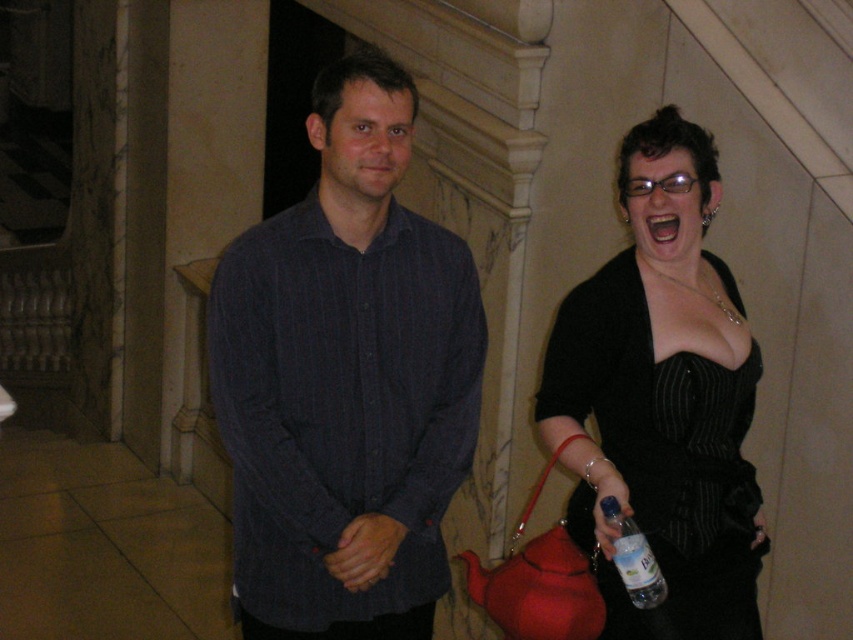
You are a photographer setting up for a formal event. You have to decide which object to focus on first between the black satin dress at right and the clear plastic bottle at lower right. Considering their sizes, which one should you prioritize?

The black satin dress at right has a larger size compared to the clear plastic bottle at lower right, so you should prioritize focusing on the black satin dress at right first.

You are standing at the point marked by the coordinates point (x=662, y=396) in the image. What object is located exactly at this point?

The point (x=662, y=396) marks the black satin dress at right.